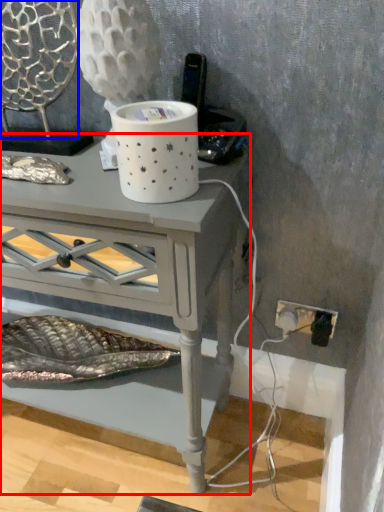
Question: Among these objects, which one is nearest to the camera, table (highlighted by a red box) or swivel chair (highlighted by a blue box)?

Choices:
 (A) table
 (B) swivel chair

Answer: (A)